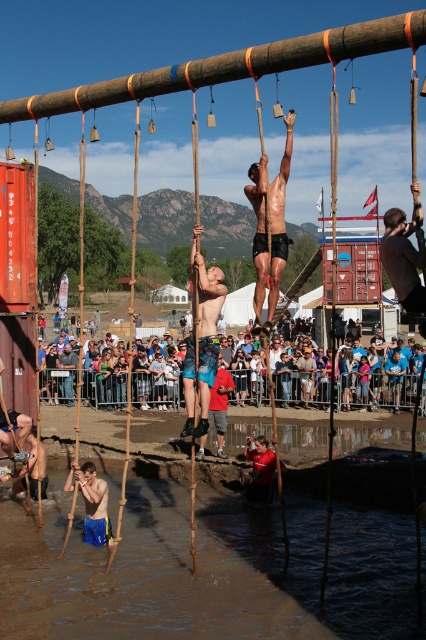
Question: Does muddy water at lower center have a larger size compared to shiny metallic shorts at center?

Choices:
 (A) yes
 (B) no

Answer: (B)

Question: Which of the following is the closest to the observer?

Choices:
 (A) (192, 333)
 (B) (52, 381)
 (C) (253, 550)

Answer: (C)

Question: Is matte black crowd at center to the right of shiny metallic pole at center from the viewer's perspective?

Choices:
 (A) no
 (B) yes

Answer: (B)

Question: Which point is farther to the camera?

Choices:
 (A) pyautogui.click(x=213, y=291)
 (B) pyautogui.click(x=255, y=204)
 (C) pyautogui.click(x=95, y=474)
 (D) pyautogui.click(x=189, y=592)

Answer: (C)

Question: Which point is closer to the camera?

Choices:
 (A) muddy water at lower center
 (B) matte blue shorts at center
 (C) shiny metallic pole at center
 (D) matte black crowd at center

Answer: (A)

Question: Does muddy water at lower center lie behind matte black crowd at center?

Choices:
 (A) yes
 (B) no

Answer: (B)